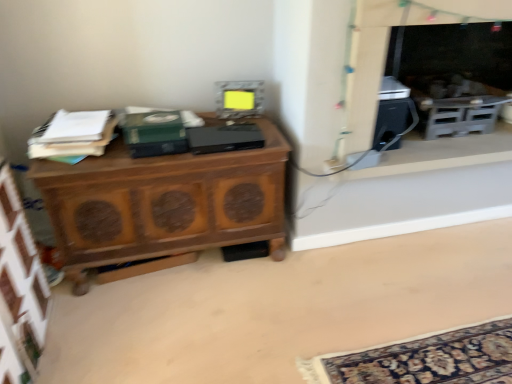
Question: Should I look upward or downward to see dark gray stone fireplace at upper right, the second fireplace in the front-to-back sequence?

Choices:
 (A) down
 (B) up

Answer: (B)

Question: From a real-world perspective, is black plastic speaker at right physically above wooden cabinet at left?

Choices:
 (A) no
 (B) yes

Answer: (B)

Question: Does black plastic speaker at right have a smaller size compared to wooden cabinet at left?

Choices:
 (A) yes
 (B) no

Answer: (A)

Question: From the image's perspective, is black plastic speaker at right located above wooden cabinet at left?

Choices:
 (A) no
 (B) yes

Answer: (B)

Question: Does black plastic speaker at right have a larger size compared to wooden cabinet at left?

Choices:
 (A) no
 (B) yes

Answer: (A)

Question: Can you confirm if black plastic speaker at right is positioned to the left of wooden cabinet at left?

Choices:
 (A) yes
 (B) no

Answer: (B)

Question: Does black plastic speaker at right have a greater height compared to wooden cabinet at left?

Choices:
 (A) yes
 (B) no

Answer: (B)

Question: From a real-world perspective, is white paper stack at left, the 2th book positioned from the right, located beneath black plastic speaker at right?

Choices:
 (A) no
 (B) yes

Answer: (A)

Question: Can black plastic speaker at right be found inside white paper stack at left, which appears as the first book when viewed from the left?

Choices:
 (A) no
 (B) yes

Answer: (A)

Question: Is white paper stack at left, the 2th book positioned from the right, to the right of black plastic speaker at right from the viewer's perspective?

Choices:
 (A) yes
 (B) no

Answer: (B)

Question: From a real-world perspective, is white paper stack at left, which appears as the first book when viewed from the left, on top of black plastic speaker at right?

Choices:
 (A) no
 (B) yes

Answer: (B)

Question: Does white paper stack at left, which appears as the first book when viewed from the left, have a greater width compared to black plastic speaker at right?

Choices:
 (A) yes
 (B) no

Answer: (B)

Question: Is white paper stack at left, the 2th book positioned from the right, positioned in front of black plastic speaker at right?

Choices:
 (A) no
 (B) yes

Answer: (B)

Question: Are black plastic speaker at right and matte gray microwave at center far apart?

Choices:
 (A) yes
 (B) no

Answer: (B)